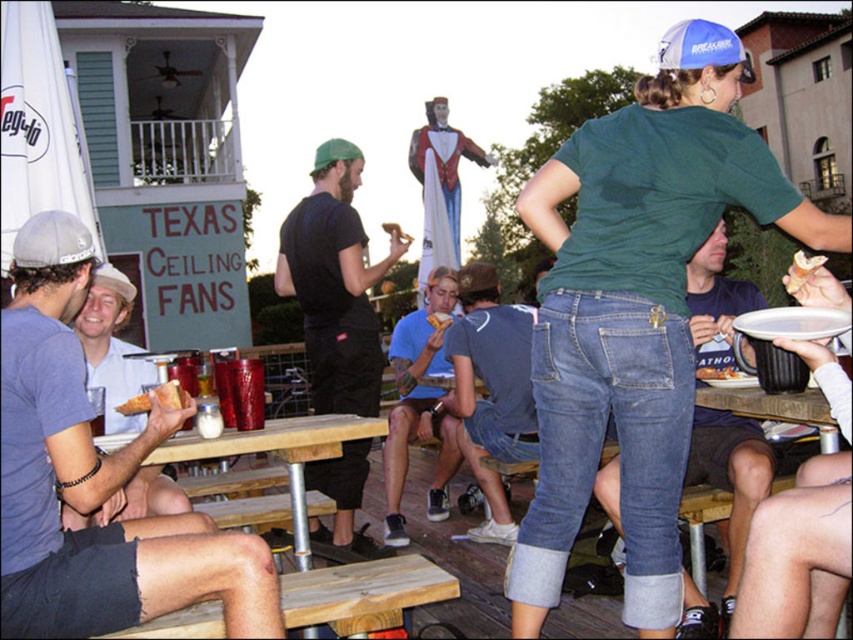
Question: Considering the relative positions of green matte shirt at upper right and white glossy plate at lower center in the image provided, where is green matte shirt at upper right located with respect to white glossy plate at lower center?

Choices:
 (A) right
 (B) left

Answer: (B)

Question: Among these objects, which one is nearest to the camera?

Choices:
 (A) matte black shirt at upper left
 (B) white glossy plate at lower center
 (C) denim/cuffed jeans at center

Answer: (A)

Question: Which point appears farthest from the camera in this image?

Choices:
 (A) (247, 432)
 (B) (74, 572)
 (C) (183, 388)

Answer: (A)

Question: Which of the following is the farthest from the observer?

Choices:
 (A) white glossy plate at lower center
 (B) golden bread at lower left
 (C) denim/cuffed jeans at center
 (D) matte white shirt at left

Answer: (A)

Question: Can you confirm if wooden table at center is positioned above white glossy plate at lower center?

Choices:
 (A) no
 (B) yes

Answer: (A)

Question: Considering the relative positions of matte black shirt at upper left and denim/cuffed jeans at center in the image provided, where is matte black shirt at upper left located with respect to denim/cuffed jeans at center?

Choices:
 (A) below
 (B) above

Answer: (B)